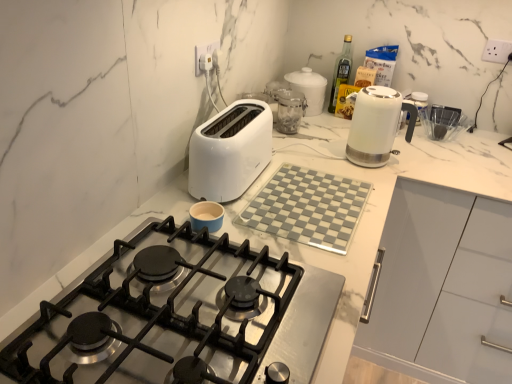
Question: Does white plastic toaster at center have a greater height compared to clear glass jar at center, which appears as the second kitchen appliance when viewed from the back?

Choices:
 (A) no
 (B) yes

Answer: (B)

Question: Is white plastic toaster at center at the right side of clear glass jar at center, which ranks as the second kitchen appliance in front-to-back order?

Choices:
 (A) no
 (B) yes

Answer: (A)

Question: Is clear glass jar at center, which ranks as the second kitchen appliance in front-to-back order, at the back of white plastic toaster at center?

Choices:
 (A) no
 (B) yes

Answer: (A)

Question: Is white plastic toaster at center not near clear glass jar at center, which ranks as the second kitchen appliance in front-to-back order?

Choices:
 (A) yes
 (B) no

Answer: (B)

Question: Does white plastic toaster at center have a greater width compared to clear glass jar at center, which ranks as the second kitchen appliance in front-to-back order?

Choices:
 (A) yes
 (B) no

Answer: (B)

Question: From the image's perspective, is white plastic toaster at center on clear glass jar at center, which appears as the second kitchen appliance when viewed from the back?

Choices:
 (A) yes
 (B) no

Answer: (B)

Question: Can you confirm if white glossy jar at upper center, marked as the 1th kitchen appliance in a back-to-front arrangement, is taller than white marble cutting board at upper center?

Choices:
 (A) no
 (B) yes

Answer: (A)

Question: Can you confirm if white glossy jar at upper center, marked as the 1th kitchen appliance in a back-to-front arrangement, is wider than white marble cutting board at upper center?

Choices:
 (A) yes
 (B) no

Answer: (B)

Question: From the image's perspective, does white glossy jar at upper center, placed as the 3th kitchen appliance when sorted from front to back, appear lower than white marble cutting board at upper center?

Choices:
 (A) no
 (B) yes

Answer: (A)

Question: Is the depth of white glossy jar at upper center, placed as the 3th kitchen appliance when sorted from front to back, less than that of white marble cutting board at upper center?

Choices:
 (A) no
 (B) yes

Answer: (A)

Question: Would you say white glossy jar at upper center, placed as the 3th kitchen appliance when sorted from front to back, is outside white marble cutting board at upper center?

Choices:
 (A) no
 (B) yes

Answer: (B)

Question: Can you confirm if white glossy jar at upper center, marked as the 1th kitchen appliance in a back-to-front arrangement, is positioned to the left of white marble cutting board at upper center?

Choices:
 (A) yes
 (B) no

Answer: (A)

Question: From a real-world perspective, does stainless steel gas stove at center sit lower than white glossy jar at upper center, marked as the 1th kitchen appliance in a back-to-front arrangement?

Choices:
 (A) no
 (B) yes

Answer: (B)